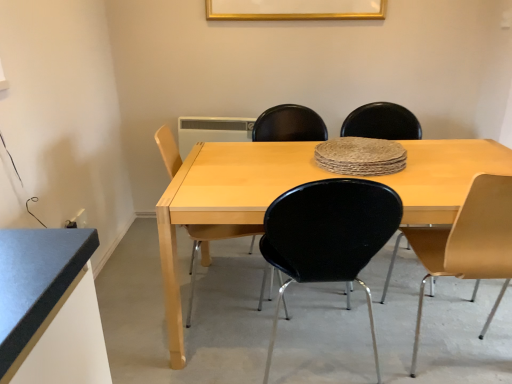
Image resolution: width=512 pixels, height=384 pixels. Find the location of `vacant region in front of light wood/black plastic chair at center, which is the 4th chair from right to left`. vacant region in front of light wood/black plastic chair at center, which is the 4th chair from right to left is located at coordinates (196, 355).